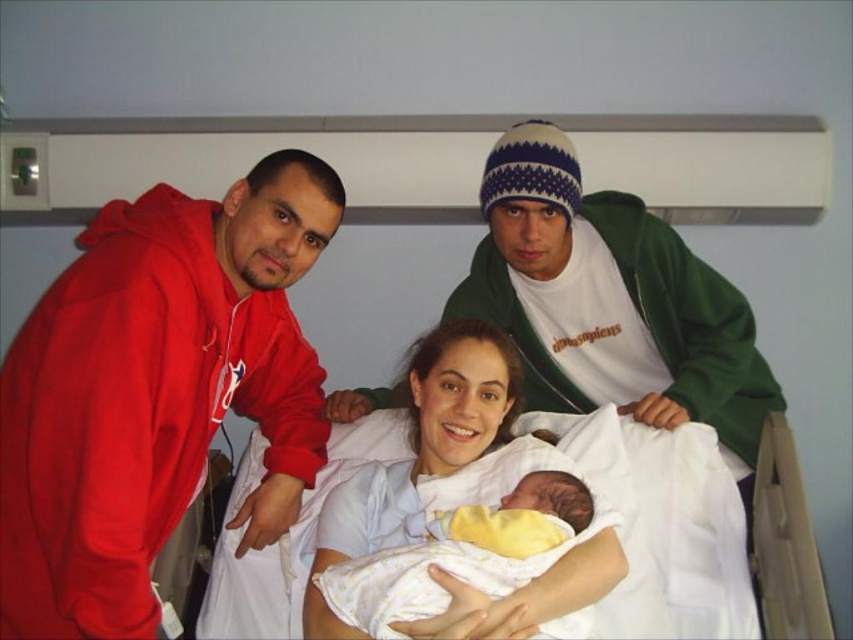
Which of these two, white fabric at center or yellow soft fabric newborn at center, stands shorter?

Standing shorter between the two is yellow soft fabric newborn at center.

Is white fabric at center smaller than yellow soft fabric newborn at center?

Incorrect, white fabric at center is not smaller in size than yellow soft fabric newborn at center.

Is point (519, 440) closer to viewer compared to point (477, 506)?

No, it is behind (477, 506).

Find the location of a particular element. white fabric at center is located at coordinates (448, 500).

Does matte red hoodie at left appear under yellow soft fabric newborn at center?

No, matte red hoodie at left is not below yellow soft fabric newborn at center.

Based on the photo, does matte red hoodie at left appear on the right side of yellow soft fabric newborn at center?

No, matte red hoodie at left is not to the right of yellow soft fabric newborn at center.

Is point (207, 209) positioned in front of point (579, 492)?

Yes, point (207, 209) is in front of point (579, 492).

Identify the location of matte red hoodie at left. (155, 392).

Is matte red hoodie at left wider than white fabric at center?

No, matte red hoodie at left is not wider than white fabric at center.

Between point (102, 260) and point (544, 461), which one is positioned in front?

Point (102, 260) is in front.

Where is `matte red hoodie at left`? This screenshot has height=640, width=853. matte red hoodie at left is located at coordinates (155, 392).

Identify the location of matte red hoodie at left. Image resolution: width=853 pixels, height=640 pixels. (155, 392).